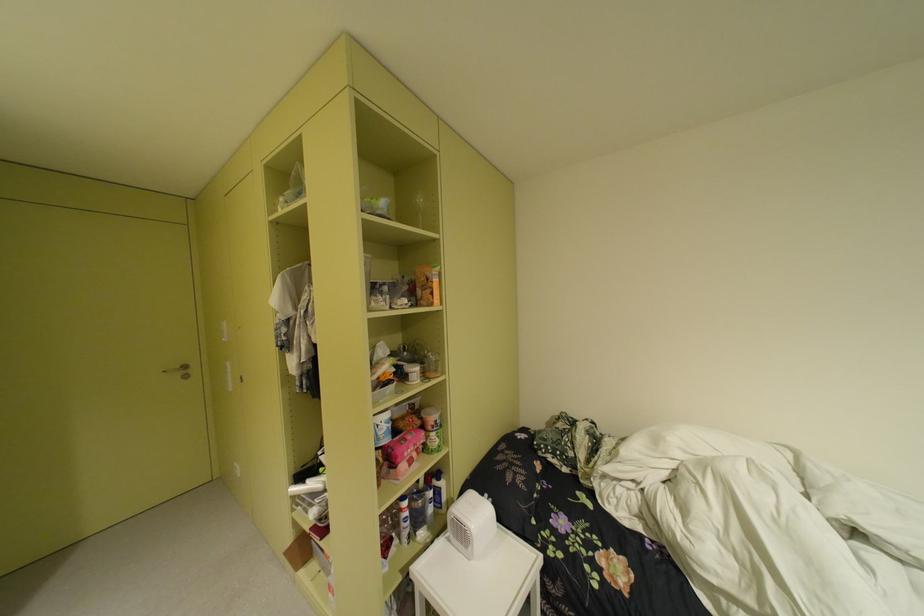
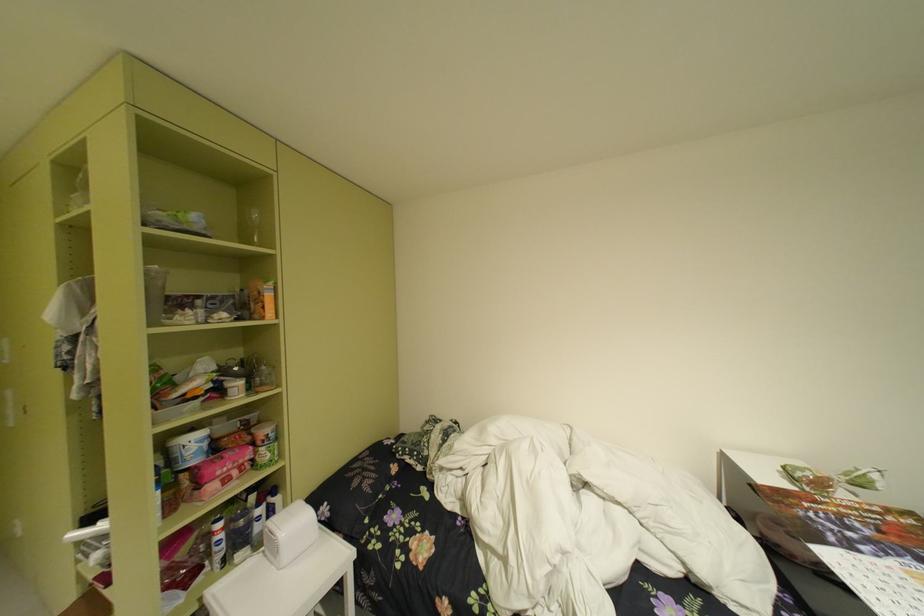
In the second image, find the point that corresponds to (x=419, y=437) in the first image.

(238, 455)